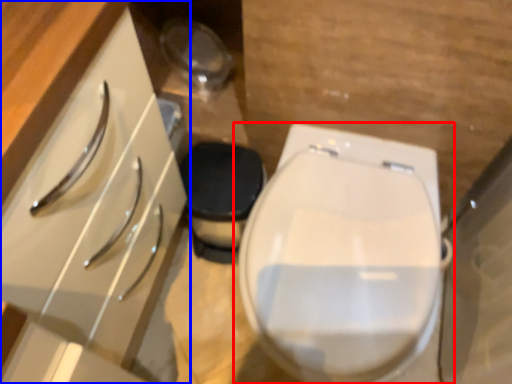
Question: Which object is further to the camera taking this photo, toilet (highlighted by a red box) or cabinetry (highlighted by a blue box)?

Choices:
 (A) toilet
 (B) cabinetry

Answer: (A)